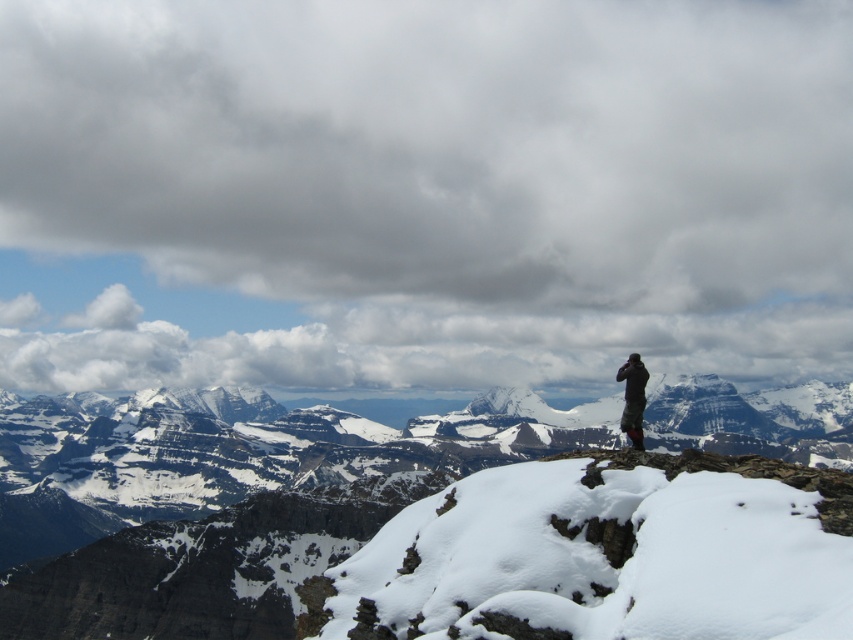
Question: Which point is closer to the camera taking this photo?

Choices:
 (A) (506, 625)
 (B) (167, 221)
 (C) (639, 429)

Answer: (A)

Question: Does cloudy sky at upper center have a larger size compared to dark gray fabric at upper right?

Choices:
 (A) yes
 (B) no

Answer: (A)

Question: Which point is farther to the camera?

Choices:
 (A) cloudy sky at upper center
 (B) dark gray fabric at upper right
 (C) snowy rocky mountain at center

Answer: (A)

Question: Which is farther from the cloudy sky at upper center?

Choices:
 (A) dark gray fabric at upper right
 (B) snowy rocky mountain at center

Answer: (A)

Question: Is cloudy sky at upper center smaller than dark gray fabric at upper right?

Choices:
 (A) no
 (B) yes

Answer: (A)

Question: Can you confirm if cloudy sky at upper center is positioned to the left of snowy rocky mountain at center?

Choices:
 (A) yes
 (B) no

Answer: (B)